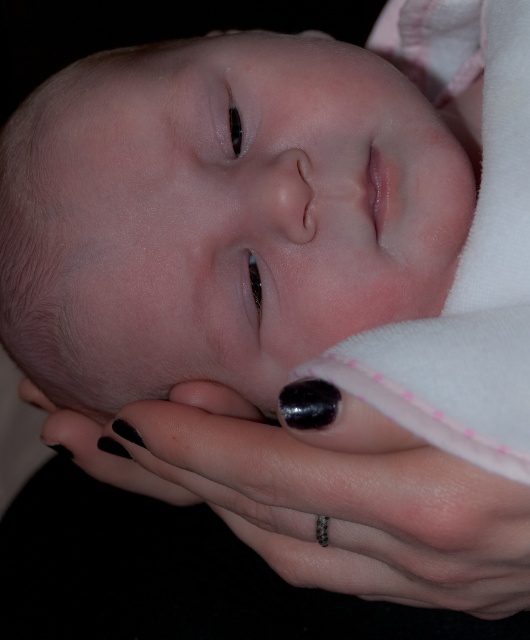
Question: Is smooth skin baby at center positioned in front of black polished nail at lower center?

Choices:
 (A) no
 (B) yes

Answer: (A)

Question: Among these objects, which one is farthest from the camera?

Choices:
 (A) black polished nail at lower center
 (B) smooth skin baby at center

Answer: (B)

Question: Is smooth skin baby at center below black polished nail at lower center?

Choices:
 (A) no
 (B) yes

Answer: (A)

Question: Which point appears farthest from the camera in this image?

Choices:
 (A) (269, 280)
 (B) (409, 515)

Answer: (A)

Question: Is smooth skin baby at center behind black polished nail at lower center?

Choices:
 (A) no
 (B) yes

Answer: (B)

Question: Which object is farther from the camera taking this photo?

Choices:
 (A) smooth skin baby at center
 (B) black polished nail at lower center

Answer: (A)